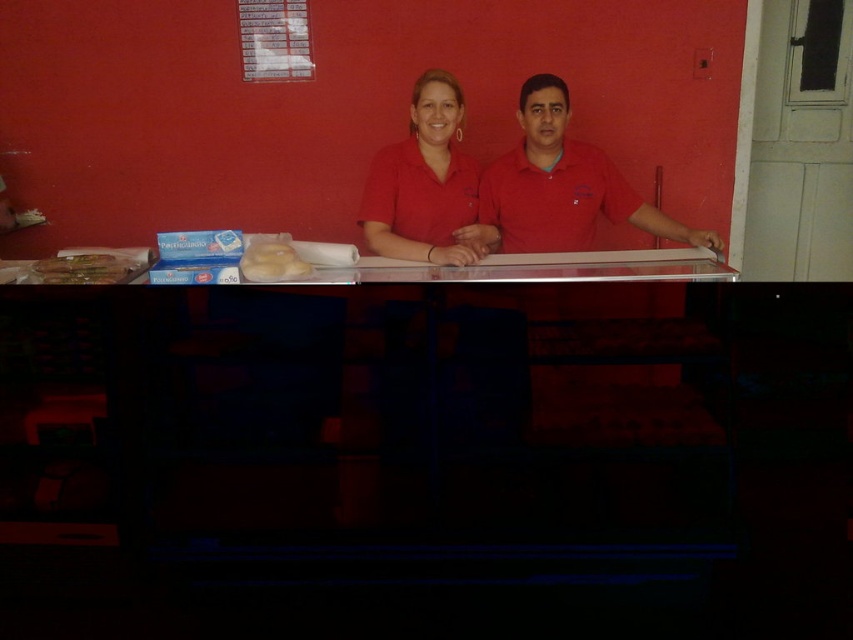
Does matte red shirt at center appear on the left side of matte brown bread at left?

Incorrect, matte red shirt at center is not on the left side of matte brown bread at left.

Describe the element at coordinates (426, 184) in the screenshot. I see `matte red shirt at center` at that location.

The width and height of the screenshot is (853, 640). What are the coordinates of `matte red shirt at center` in the screenshot? It's located at (426, 184).

Which of these two, matte brown bread at left or white fluffy bread at center, stands shorter?

matte brown bread at left is shorter.

Can you confirm if matte brown bread at left is wider than white fluffy bread at center?

Correct, the width of matte brown bread at left exceeds that of white fluffy bread at center.

I want to click on matte brown bread at left, so click(83, 268).

Where is `matte brown bread at left`? matte brown bread at left is located at coordinates (83, 268).

Is red matte shirt at center wider than white fluffy bread at center?

Yes.

Can you confirm if red matte shirt at center is bigger than white fluffy bread at center?

Yes, red matte shirt at center is bigger than white fluffy bread at center.

Does point (560, 99) come in front of point (254, 257)?

No, it is not.

Where is `red matte shirt at center`? The width and height of the screenshot is (853, 640). red matte shirt at center is located at coordinates (561, 184).